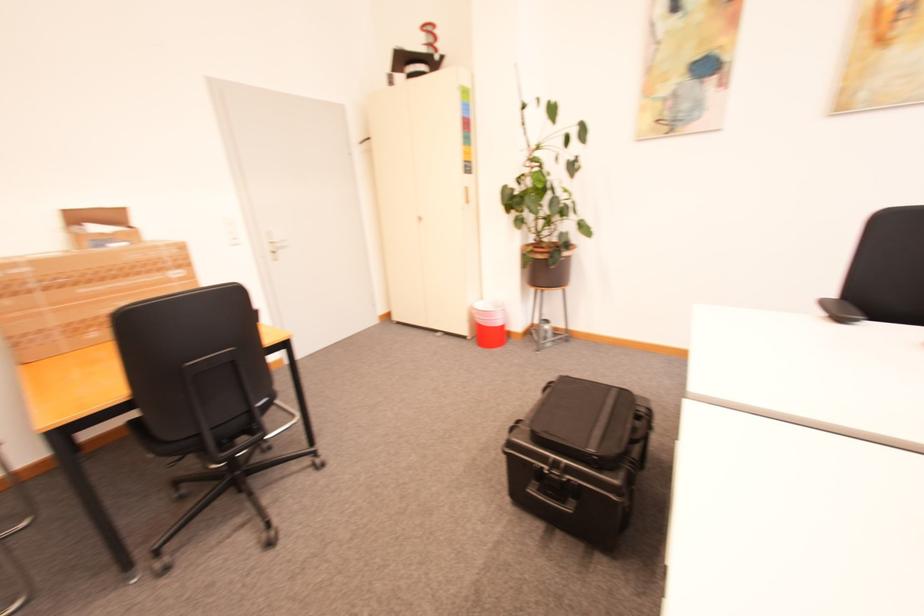
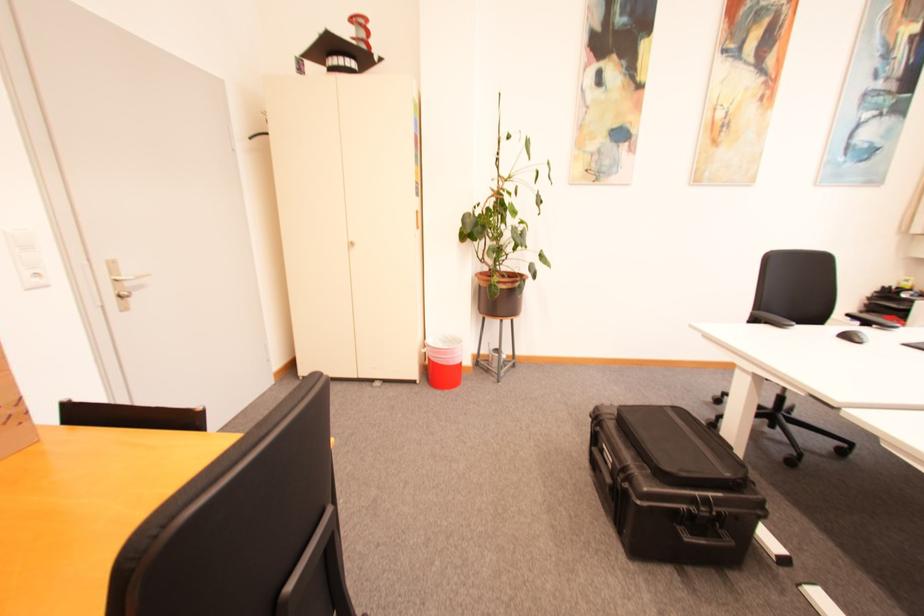
The point at (427, 219) is marked in the first image. Where is the corresponding point in the second image?

(359, 245)